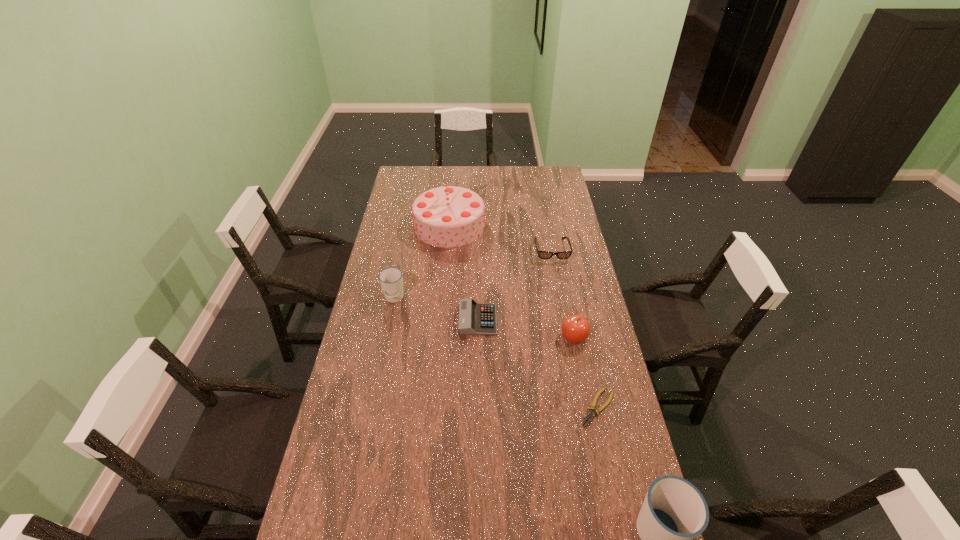
The width and height of the screenshot is (960, 540). What are the coordinates of `the shorter cup` in the screenshot? It's located at (391, 279).

In order to click on the left cup in this screenshot , I will do `click(391, 279)`.

What are the coordinates of `the tallest object` in the screenshot? It's located at (449, 216).

Locate an element on the screen. the third shortest object is located at coordinates (541, 254).

Where is `apple`? apple is located at coordinates (575, 328).

At what (x,y) coordinates should I click in order to perform the action: click on pliers. Please return your answer as a coordinate pair (x, y). This screenshot has width=960, height=540. Looking at the image, I should click on (591, 414).

Identify the location of the second nearest object. The height and width of the screenshot is (540, 960). (591, 414).

You are a GUI agent. You are given a task and a screenshot of the screen. Output one action in this format:
    pyautogui.click(x=<x>, y=<y>)
    Task: Click on the second shortest object
    The width and height of the screenshot is (960, 540).
    Given the screenshot: What is the action you would take?
    pyautogui.click(x=475, y=318)

At what (x,y) coordinates should I click in order to perform the action: click on vacant space located 0.280m with a handle on the side of the shorter cup. Please return your answer as a coordinate pair (x, y). Looking at the image, I should click on (380, 367).

Locate an element on the screen. The image size is (960, 540). free point located 0.070m on the front of the birthday cake is located at coordinates (446, 258).